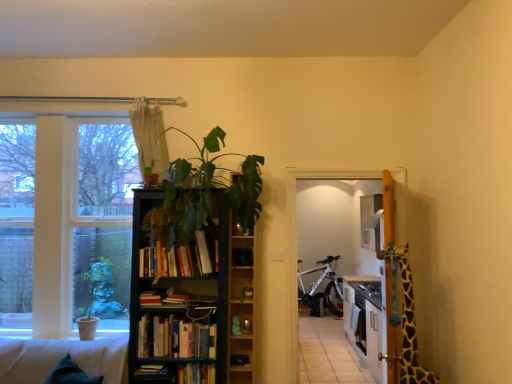
Question: Is white matte bicycle at center surrounding beige fabric curtain at upper center?

Choices:
 (A) no
 (B) yes

Answer: (A)

Question: Considering the relative positions of white matte bicycle at center and beige fabric curtain at upper center in the image provided, is white matte bicycle at center to the right of beige fabric curtain at upper center from the viewer's perspective?

Choices:
 (A) yes
 (B) no

Answer: (A)

Question: Is white matte bicycle at center at the left side of beige fabric curtain at upper center?

Choices:
 (A) no
 (B) yes

Answer: (A)

Question: Is white matte bicycle at center aimed at beige fabric curtain at upper center?

Choices:
 (A) no
 (B) yes

Answer: (B)

Question: Is there a large distance between white matte bicycle at center and beige fabric curtain at upper center?

Choices:
 (A) no
 (B) yes

Answer: (B)

Question: From a real-world perspective, is white matte bicycle at center physically below beige fabric curtain at upper center?

Choices:
 (A) no
 (B) yes

Answer: (B)

Question: Does hardcover book at center, which is counted as the 4th book, starting from the top, have a lesser width compared to beige fabric curtain at upper center?

Choices:
 (A) yes
 (B) no

Answer: (B)

Question: Can you confirm if hardcover book at center, which is counted as the 4th book, starting from the top, is positioned to the left of beige fabric curtain at upper center?

Choices:
 (A) no
 (B) yes

Answer: (A)

Question: From the image's perspective, is hardcover book at center, which is the 1th book in bottom-to-top order, beneath beige fabric curtain at upper center?

Choices:
 (A) yes
 (B) no

Answer: (A)

Question: Does hardcover book at center, which is the 1th book in bottom-to-top order, contain beige fabric curtain at upper center?

Choices:
 (A) no
 (B) yes

Answer: (A)

Question: Considering the relative sizes of hardcover book at center, which is the 1th book in bottom-to-top order, and beige fabric curtain at upper center in the image provided, is hardcover book at center, which is the 1th book in bottom-to-top order, shorter than beige fabric curtain at upper center?

Choices:
 (A) yes
 (B) no

Answer: (A)

Question: Is beige fabric curtain at upper center at the back of hardcover book at center, which is the 1th book in bottom-to-top order?

Choices:
 (A) yes
 (B) no

Answer: (B)

Question: Is beige fabric curtain at upper center positioned far away from waffle-textured white couch at lower left?

Choices:
 (A) yes
 (B) no

Answer: (A)